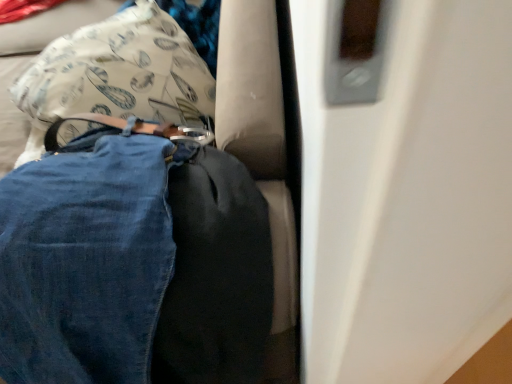
Find the location of a particular element. Image resolution: width=512 pixels, height=384 pixels. white fabric pillow at center is located at coordinates (120, 72).

Describe the element at coordinates (120, 72) in the screenshot. I see `white fabric pillow at center` at that location.

The width and height of the screenshot is (512, 384). Describe the element at coordinates (133, 262) in the screenshot. I see `denim at left` at that location.

In order to face denim at left, should I rotate leftwards or rightwards?

Turn left by 21.387 degrees to look at denim at left.

Where is `denim at left`? The width and height of the screenshot is (512, 384). denim at left is located at coordinates (133, 262).

Find the location of a particular element. Image resolution: width=512 pixels, height=384 pixels. white fabric pillow at center is located at coordinates (120, 72).

Considering the relative positions of denim at left and white fabric pillow at center in the image provided, is denim at left to the left of white fabric pillow at center from the viewer's perspective?

Incorrect, denim at left is not on the left side of white fabric pillow at center.

Which object is closer to the camera taking this photo, denim at left or white fabric pillow at center?

denim at left is more forward.

Does point (261, 275) lie behind point (159, 36)?

No.

From the image's perspective, is denim at left over white fabric pillow at center?

No, from the image's perspective, denim at left is not on top of white fabric pillow at center.

From a real-world perspective, is denim at left positioned above or below white fabric pillow at center?

In terms of real-world spatial position, denim at left is above white fabric pillow at center.

Considering the sizes of denim at left and white fabric pillow at center in the image, is denim at left wider or thinner than white fabric pillow at center?

In the image, denim at left appears to be wider than white fabric pillow at center.

Considering the relative sizes of denim at left and white fabric pillow at center in the image provided, is denim at left taller than white fabric pillow at center?

Indeed, denim at left has a greater height compared to white fabric pillow at center.

Is denim at left smaller than white fabric pillow at center?

Actually, denim at left might be larger than white fabric pillow at center.

Is white fabric pillow at center inside denim at left?

No, white fabric pillow at center is not surrounded by denim at left.

Is denim at left next to white fabric pillow at center and touching it?

No, denim at left is not next to white fabric pillow at center.

Is denim at left aimed at white fabric pillow at center?

No, denim at left is not aimed at white fabric pillow at center.

How much distance is there between denim at left and white fabric pillow at center?

denim at left and white fabric pillow at center are 10.86 inches apart from each other.

This screenshot has height=384, width=512. I want to click on trousers that appears in front of the white fabric pillow at center, so click(x=133, y=262).

Considering the positions of objects white fabric pillow at center and denim at left in the image provided, who is more to the left, white fabric pillow at center or denim at left?

From the viewer's perspective, white fabric pillow at center appears more on the left side.

Relative to denim at left, is white fabric pillow at center in front or behind?

white fabric pillow at center is behind denim at left.

Considering the positions of point (111, 73) and point (82, 224), is point (111, 73) closer or farther from the camera than point (82, 224)?

Point (111, 73) is positioned farther from the camera compared to point (82, 224).

From the image's perspective, is white fabric pillow at center on denim at left?

Indeed, from the image's perspective, white fabric pillow at center is shown above denim at left.

From a real-world perspective, is white fabric pillow at center above or below denim at left?

white fabric pillow at center is below denim at left.

Can you confirm if white fabric pillow at center is thinner than denim at left?

Correct, the width of white fabric pillow at center is less than that of denim at left.

From their relative heights in the image, would you say white fabric pillow at center is taller or shorter than denim at left?

white fabric pillow at center is shorter than denim at left.

Who is bigger, white fabric pillow at center or denim at left?

denim at left.

Consider the image. Do you think white fabric pillow at center is within denim at left, or outside of it?

white fabric pillow at center is outside denim at left.

Is there a large distance between white fabric pillow at center and denim at left?

white fabric pillow at center is near denim at left, not far away.

Is white fabric pillow at center turned away from denim at left?

No, white fabric pillow at center's orientation is not away from denim at left.

Can you tell me how much white fabric pillow at center and denim at left differ in facing direction?

70.7 degrees.

Measure the distance between white fabric pillow at center and denim at left.

white fabric pillow at center is 10.86 inches away from denim at left.

At what (x,y) coordinates should I click in order to perform the action: click on trousers on the right of white fabric pillow at center. Please return your answer as a coordinate pair (x, y). Image resolution: width=512 pixels, height=384 pixels. Looking at the image, I should click on (133, 262).

Locate an element on the screen. pillow that appears on the left of denim at left is located at coordinates (120, 72).

In order to click on pillow that is behind the denim at left in this screenshot , I will do `click(120, 72)`.